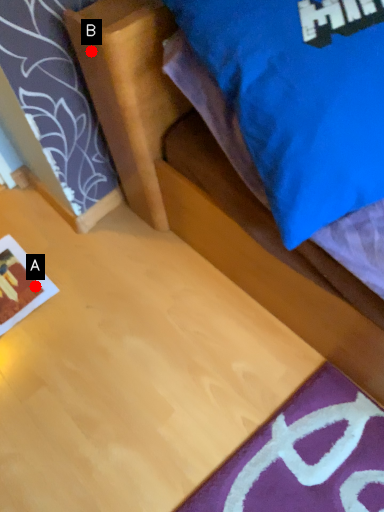
Question: Two points are circled on the image, labeled by A and B beside each circle. Among these points, which one is farthest from the camera?

Choices:
 (A) A is further
 (B) B is further

Answer: (A)